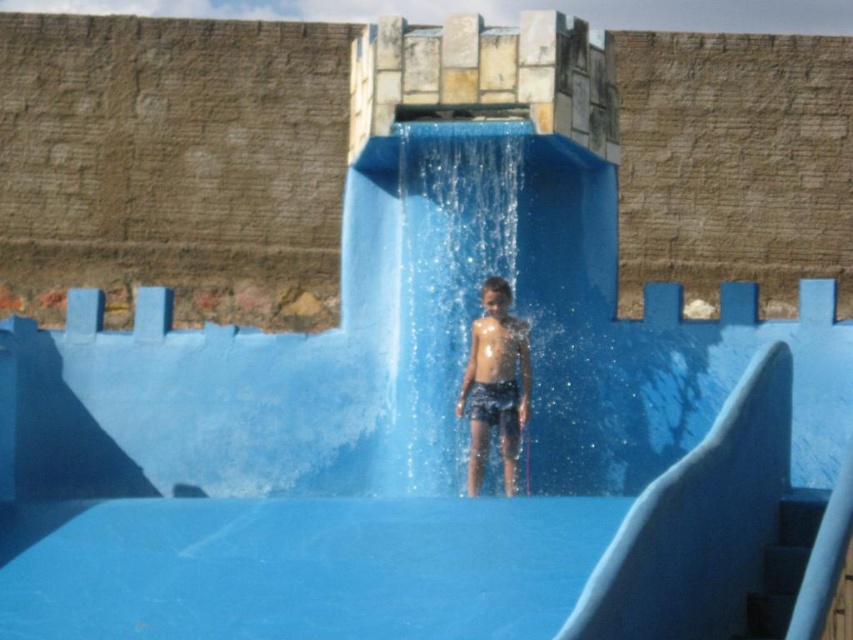
Describe the element at coordinates (698, 524) in the screenshot. I see `white glossy slide at center` at that location.

Looking at this image, is white glossy slide at center further to the viewer compared to shiny skin at center?

No, white glossy slide at center is in front of shiny skin at center.

Describe the element at coordinates (698, 524) in the screenshot. I see `white glossy slide at center` at that location.

At what (x,y) coordinates should I click in order to perform the action: click on white glossy slide at center. Please return your answer as a coordinate pair (x, y). Image resolution: width=853 pixels, height=640 pixels. Looking at the image, I should click on (698, 524).

Is clear water at center above shiny blue shorts at center?

Indeed, clear water at center is positioned over shiny blue shorts at center.

Which is in front, point (463, 195) or point (474, 353)?

Point (474, 353) is more forward.

This screenshot has width=853, height=640. Identify the location of clear water at center. (459, 298).

Who is higher up, shiny blue shorts at center or shiny skin at center?

shiny skin at center is above.

At what (x,y) coordinates should I click in order to perform the action: click on shiny blue shorts at center. Please return your answer as a coordinate pair (x, y). The width and height of the screenshot is (853, 640). Looking at the image, I should click on (495, 385).

Does point (462, 404) come farther from viewer compared to point (515, 342)?

No, it is not.

The width and height of the screenshot is (853, 640). Find the location of `shiny blue shorts at center`. shiny blue shorts at center is located at coordinates (495, 385).